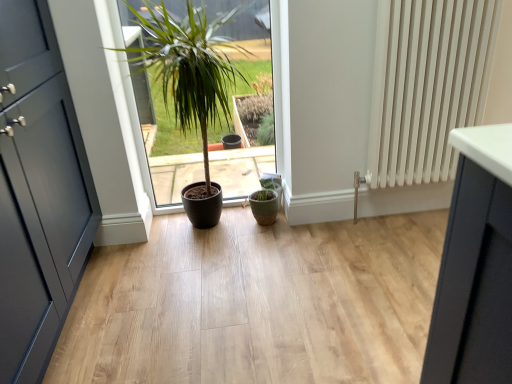
Question: Based on their sizes in the image, would you say matte brown pot at center is bigger or smaller than matte dark blue door at left?

Choices:
 (A) big
 (B) small

Answer: (B)

Question: Relative to matte dark blue door at left, is matte brown pot at center in front or behind?

Choices:
 (A) front
 (B) behind

Answer: (B)

Question: Considering the real-world distances, which object is farthest from the white ribbed radiator at right?

Choices:
 (A) matte green flowerpot at center
 (B) matte brown pot at center
 (C) matte dark blue door at left

Answer: (C)

Question: Which is nearer to the matte brown pot at center?

Choices:
 (A) matte dark blue door at left
 (B) white ribbed radiator at right
 (C) matte green flowerpot at center

Answer: (A)